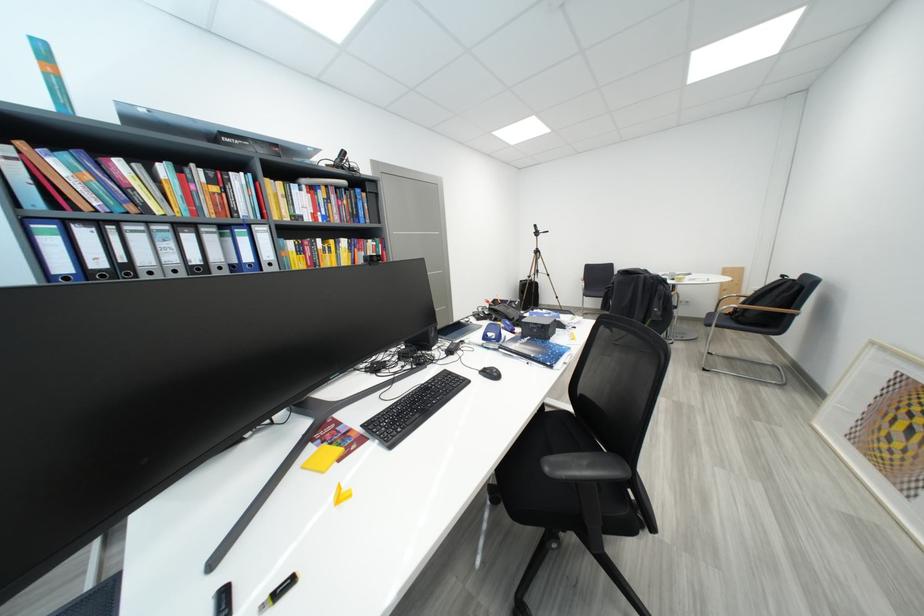
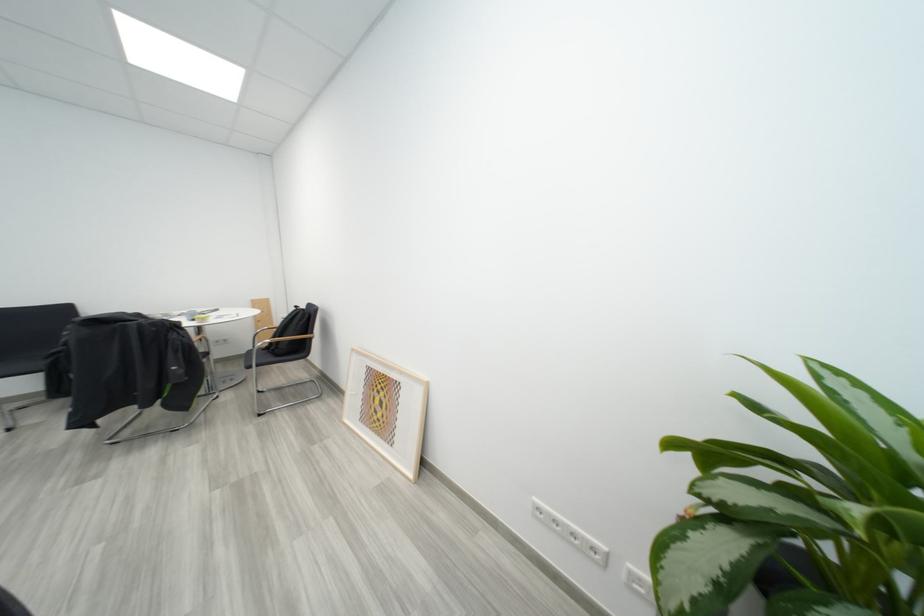
Question: The images are taken continuously from a first-person perspective. In which direction is your viewpoint rotating?

Choices:
 (A) Left
 (B) Right
 (C) Up
 (D) Down

Answer: (B)